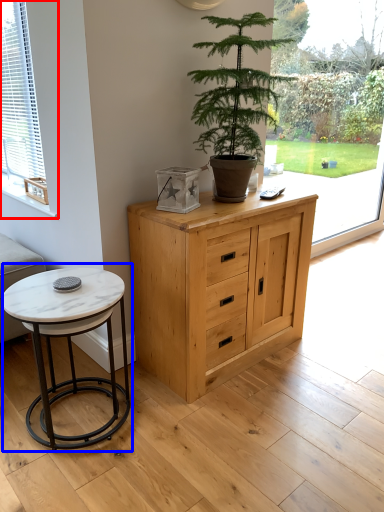
Question: Which object is further to the camera taking this photo, window (highlighted by a red box) or coffee table (highlighted by a blue box)?

Choices:
 (A) window
 (B) coffee table

Answer: (A)